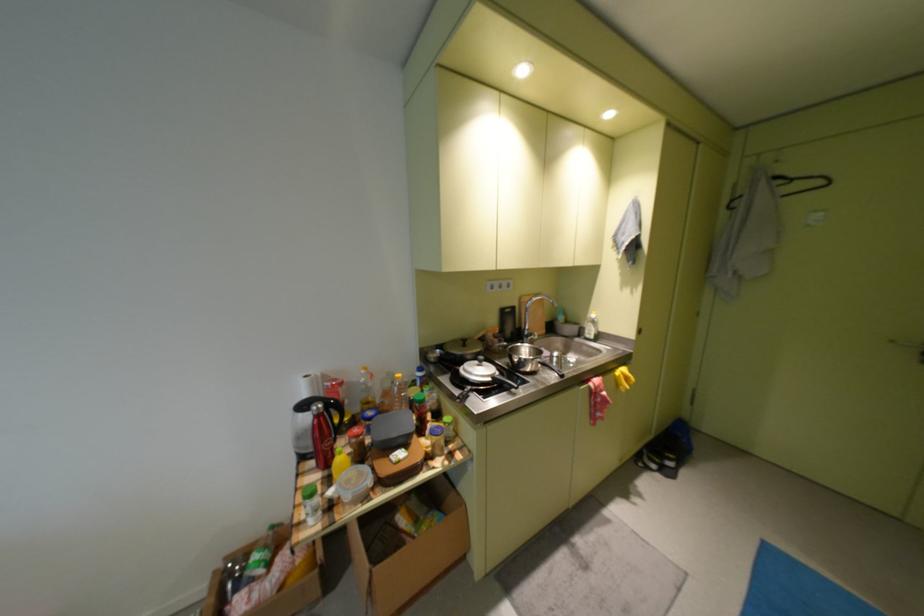
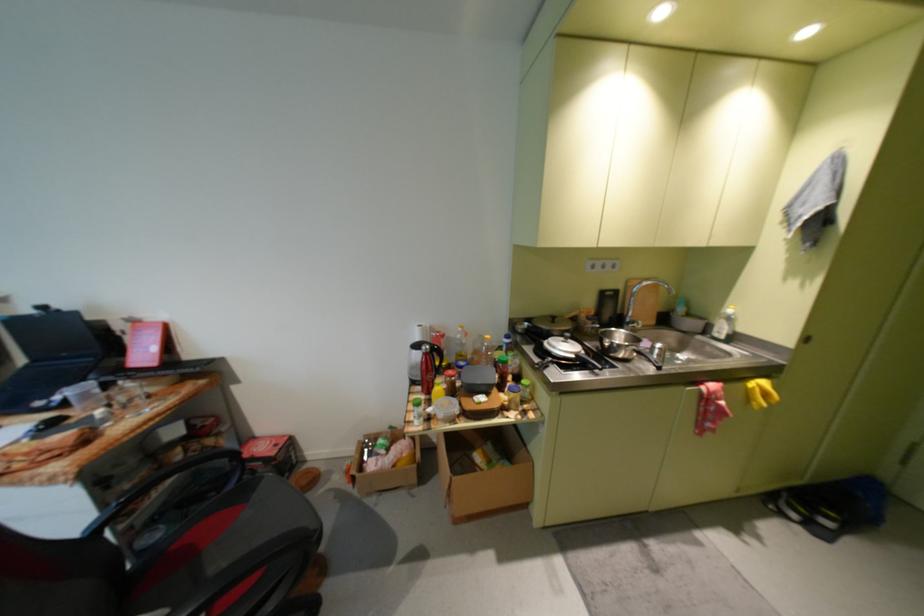
Find the pixel in the second image that matches point (382, 573) in the first image.

(462, 480)